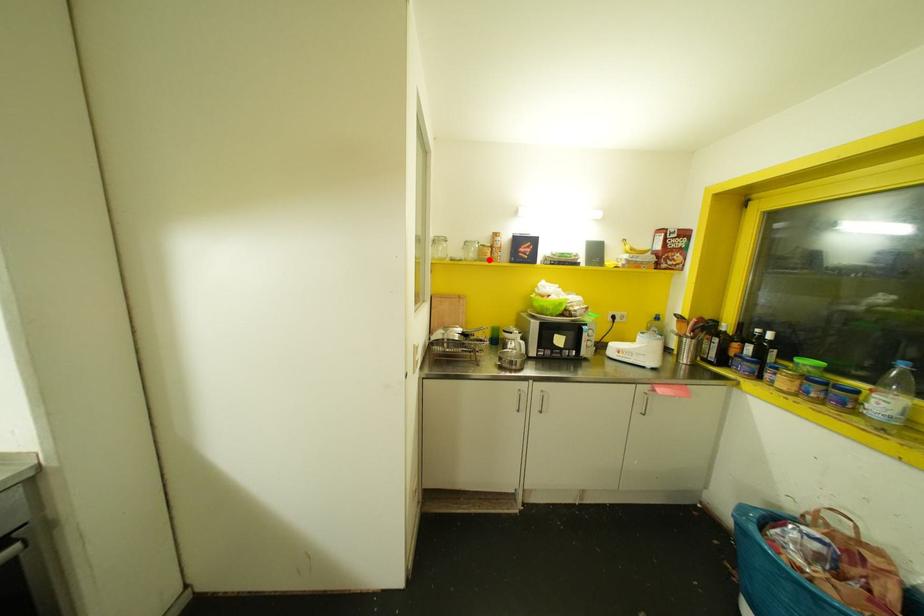
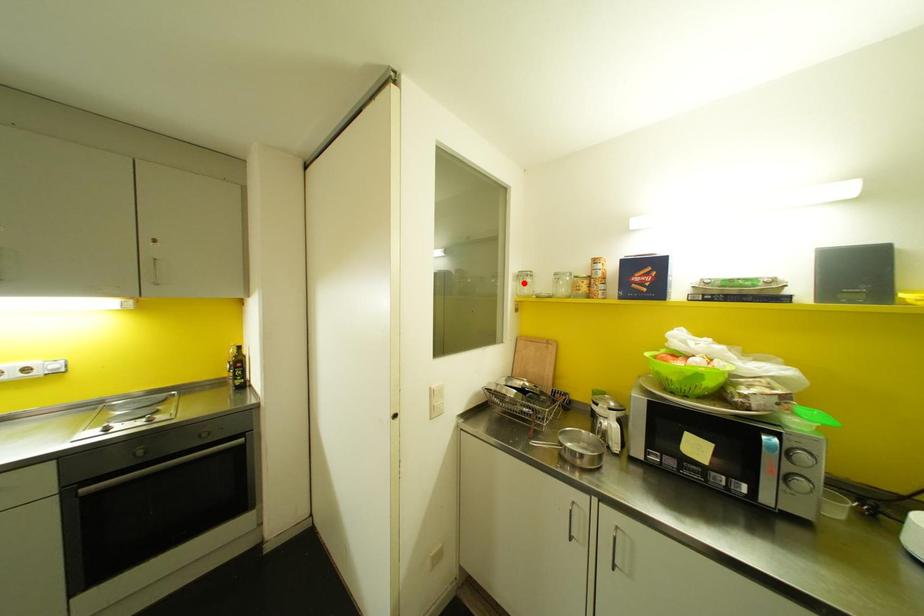
I am providing you with two images of the same scene from different viewpoints. A red point is marked on the first image and another point is marked on the second image. Do the highlighted points in image1 and image2 indicate the same real-world spot?

No